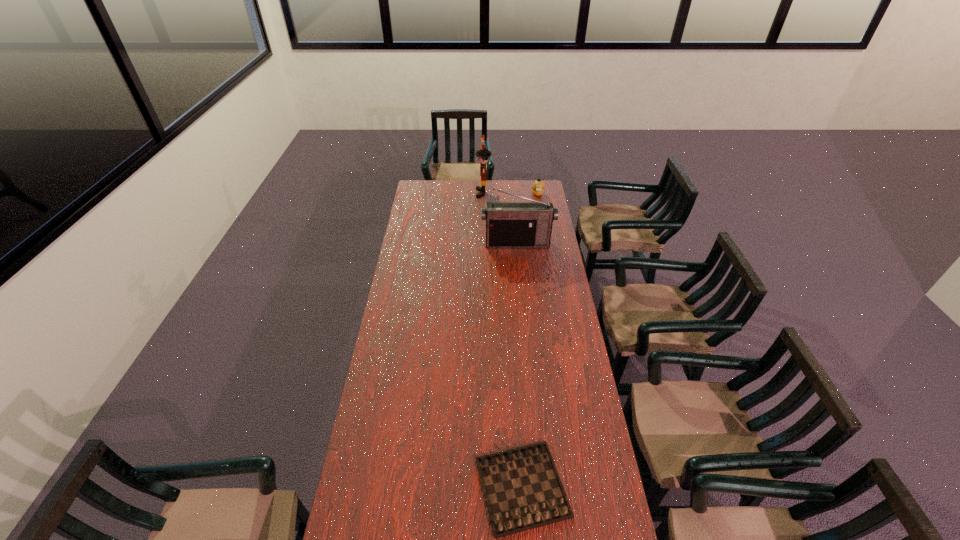
Where is `free space between the nutcracker and the shortest object`? The width and height of the screenshot is (960, 540). free space between the nutcracker and the shortest object is located at coordinates (503, 340).

Where is `vacant space that is in between the nutcracker and the shortest object`? The image size is (960, 540). vacant space that is in between the nutcracker and the shortest object is located at coordinates (503, 340).

The width and height of the screenshot is (960, 540). In order to click on vacant region between the nutcracker and the nearest object in this screenshot , I will do [503, 340].

Identify the location of empty space that is in between the chessboard and the third farthest object. (519, 365).

At what (x,y) coordinates should I click in order to perform the action: click on free space between the nutcracker and the nearest object. Please return your answer as a coordinate pair (x, y). Looking at the image, I should click on (503, 340).

Where is `empty space between the third farthest object and the chessboard`? empty space between the third farthest object and the chessboard is located at coordinates (519, 365).

Identify which object is the nearest to the nearest object. Please provide its 2D coordinates. Your answer should be formatted as a tuple, i.e. [(x, y)], where the tuple contains the x and y coordinates of a point satisfying the conditions above.

[(508, 224)]

Select which object appears as the second closest to the duckling. Please provide its 2D coordinates. Your answer should be formatted as a tuple, i.e. [(x, y)], where the tuple contains the x and y coordinates of a point satisfying the conditions above.

[(508, 224)]

Locate an element on the screen. This screenshot has width=960, height=540. vacant region that satisfies the following two spatial constraints: 1. on the front-facing side of the nutcracker; 2. on the back side of the nearest object is located at coordinates (487, 487).

At what (x,y) coordinates should I click in order to perform the action: click on free space that satisfies the following two spatial constraints: 1. on the front-facing side of the nutcracker; 2. on the left side of the shortest object. Please return your answer as a coordinate pair (x, y). The image size is (960, 540). Looking at the image, I should click on (487, 487).